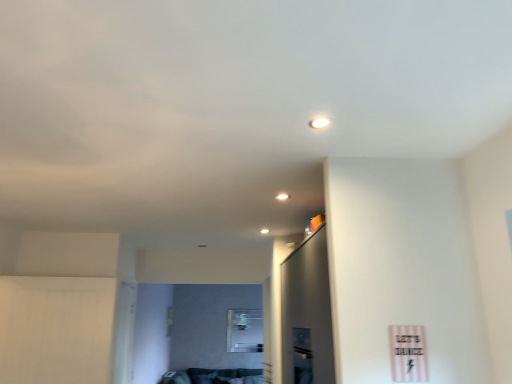
In the scene shown: What is the approximate width of velvet dark green sofa at lower center?

It is 2.08 meters.

Describe the element at coordinates (214, 376) in the screenshot. I see `velvet dark green sofa at lower center` at that location.

This screenshot has width=512, height=384. What are the coordinates of `velvet dark green sofa at lower center` in the screenshot? It's located at (214, 376).

Where is `velvet dark green sofa at lower center`? velvet dark green sofa at lower center is located at coordinates coord(214,376).